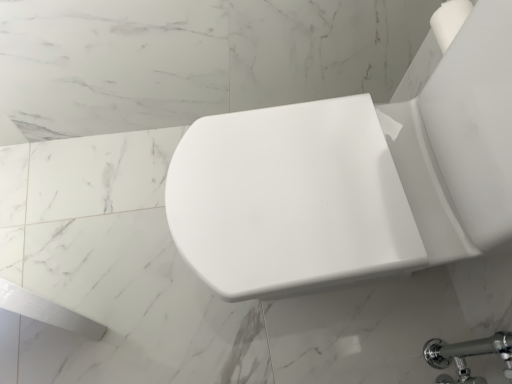
Locate an element on the screen. The width and height of the screenshot is (512, 384). free point to the left of white glossy toilet seat at center is located at coordinates (125, 236).